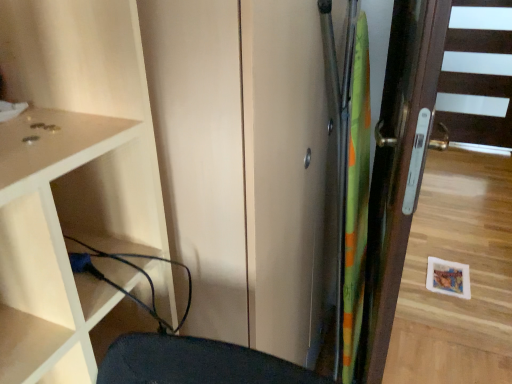
Question: From the image's perspective, would you say green fabric screen door at right is shown under brown wooden door at right?

Choices:
 (A) no
 (B) yes

Answer: (B)

Question: Does green fabric screen door at right have a lesser height compared to brown wooden door at right?

Choices:
 (A) no
 (B) yes

Answer: (A)

Question: Is green fabric screen door at right aimed at brown wooden door at right?

Choices:
 (A) no
 (B) yes

Answer: (B)

Question: Can you confirm if green fabric screen door at right is positioned to the left of brown wooden door at right?

Choices:
 (A) yes
 (B) no

Answer: (A)

Question: From a real-world perspective, is green fabric screen door at right physically above brown wooden door at right?

Choices:
 (A) no
 (B) yes

Answer: (B)

Question: From a real-world perspective, is green fabric screen door at right below brown wooden door at right?

Choices:
 (A) no
 (B) yes

Answer: (A)

Question: Are brown wooden door at right and black rubber cable at lower left located far from each other?

Choices:
 (A) yes
 (B) no

Answer: (A)

Question: Could you tell me if brown wooden door at right is turned towards black rubber cable at lower left?

Choices:
 (A) no
 (B) yes

Answer: (A)

Question: Is brown wooden door at right with black rubber cable at lower left?

Choices:
 (A) no
 (B) yes

Answer: (A)

Question: Does brown wooden door at right have a lesser width compared to black rubber cable at lower left?

Choices:
 (A) yes
 (B) no

Answer: (A)

Question: Can you confirm if brown wooden door at right is positioned to the right of black rubber cable at lower left?

Choices:
 (A) yes
 (B) no

Answer: (A)

Question: Does brown wooden door at right appear on the left side of black rubber cable at lower left?

Choices:
 (A) no
 (B) yes

Answer: (A)

Question: From a real-world perspective, is green fabric screen door at right physically below matte white cupboard at left?

Choices:
 (A) no
 (B) yes

Answer: (B)